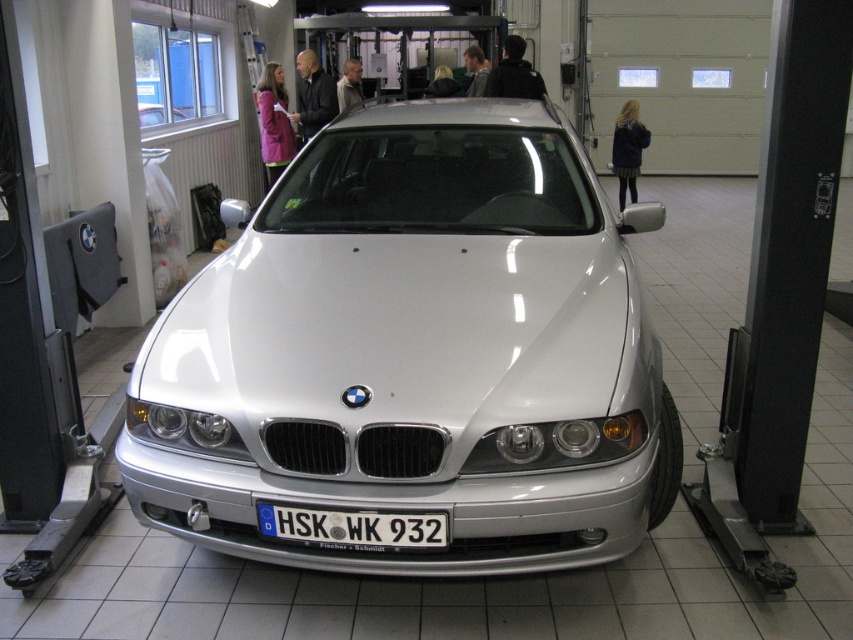
Is point (397, 154) more distant than point (144, 104)?

No, it is in front of (144, 104).

Is point (467, 496) more distant than point (180, 115)?

No, it is in front of (180, 115).

This screenshot has width=853, height=640. Find the location of `white metallic car at center`. white metallic car at center is located at coordinates (415, 355).

Between white metallic car at center and white plastic license plate at center, which one is positioned lower?

Positioned lower is white plastic license plate at center.

Is white metallic car at center further to camera compared to white plastic license plate at center?

Yes.

In order to click on white metallic car at center in this screenshot , I will do `click(415, 355)`.

Between white plastic license plate at center and satin silver car at center, which one has more height?

satin silver car at center is taller.

Between white plastic license plate at center and satin silver car at center, which one appears on the left side from the viewer's perspective?

Positioned to the left is satin silver car at center.

Locate an element on the screen. The image size is (853, 640). white plastic license plate at center is located at coordinates (352, 528).

Image resolution: width=853 pixels, height=640 pixels. Identify the location of white plastic license plate at center. (352, 528).